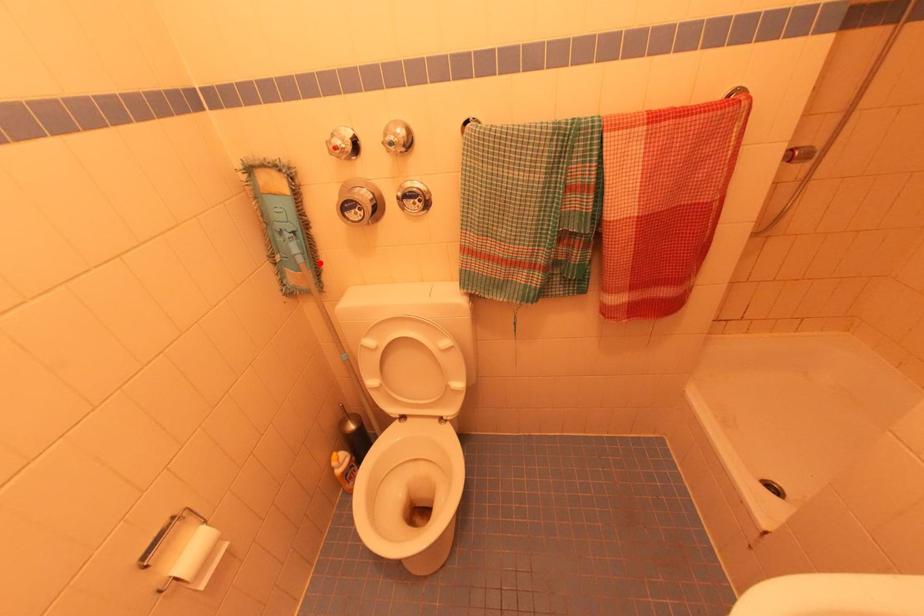
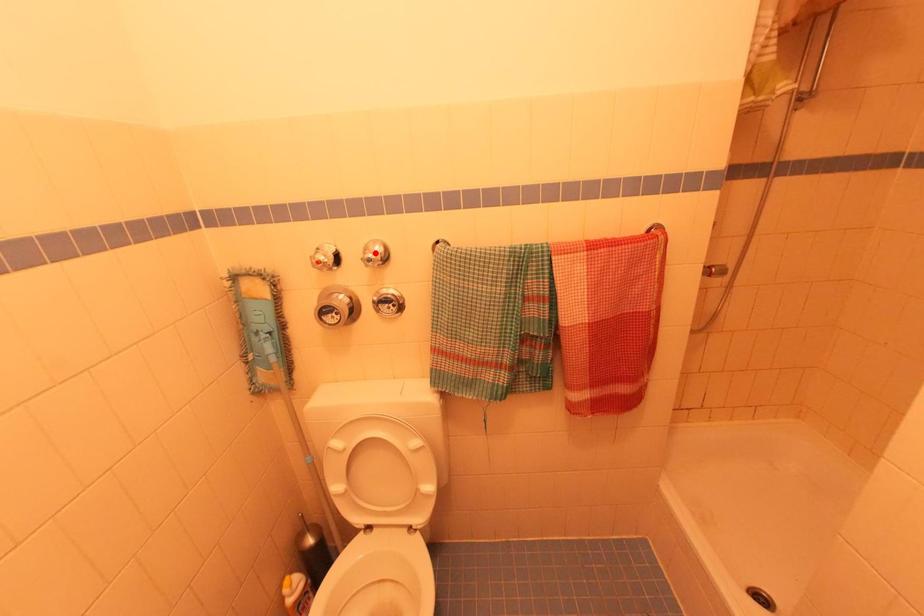
I am providing you with two images of the same scene from different viewpoints. A red point is marked on the first image and another point is marked on the second image. Do the highlighted points in image1 and image2 indicate the same real-world spot?

No